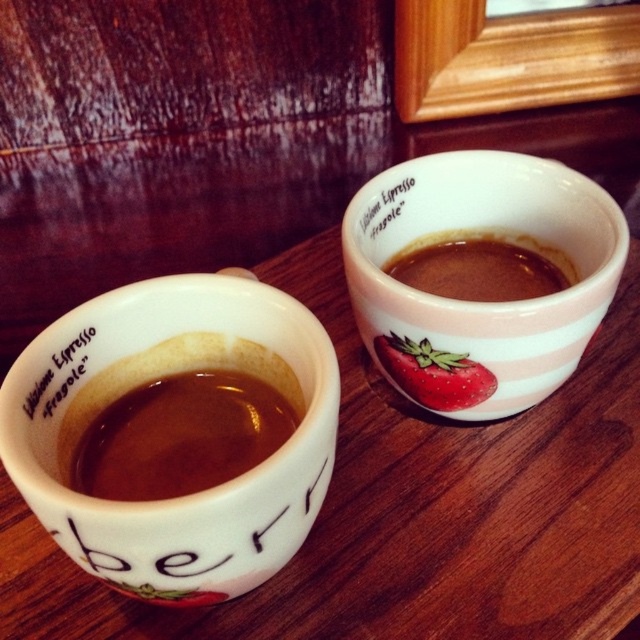
Can you confirm if brown matte espresso at left is positioned below white matte text at upper center?

Yes, brown matte espresso at left is below white matte text at upper center.

Can you confirm if brown matte espresso at left is smaller than white matte text at upper center?

Actually, brown matte espresso at left might be larger than white matte text at upper center.

What do you see at coordinates (180, 436) in the screenshot? I see `brown matte espresso at left` at bounding box center [180, 436].

Locate an element on the screen. The height and width of the screenshot is (640, 640). brown matte espresso at left is located at coordinates (180, 436).

Does white matte espresso cup at left come in front of brown matte espresso at left?

Yes, white matte espresso cup at left is closer to the viewer.

Does white matte espresso cup at left appear under brown matte espresso at left?

No, white matte espresso cup at left is not below brown matte espresso at left.

Identify the location of white matte espresso cup at left. (148, 381).

Where is `white matte espresso cup at left`? This screenshot has width=640, height=640. white matte espresso cup at left is located at coordinates coord(148,381).

Looking at this image, can you confirm if white matte espresso cup at left is bigger than white matte text at upper left?

Correct, white matte espresso cup at left is larger in size than white matte text at upper left.

Is point (140, 579) positioned after point (81, 339)?

That is False.

Where is `white matte espresso cup at left`? Image resolution: width=640 pixels, height=640 pixels. white matte espresso cup at left is located at coordinates (148, 381).